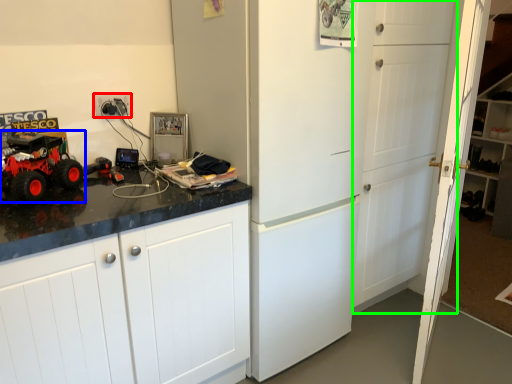
Question: Which is farther away from electric outlet (highlighted by a red box)? land vehicle (highlighted by a blue box) or door (highlighted by a green box)?

Choices:
 (A) land vehicle
 (B) door

Answer: (B)